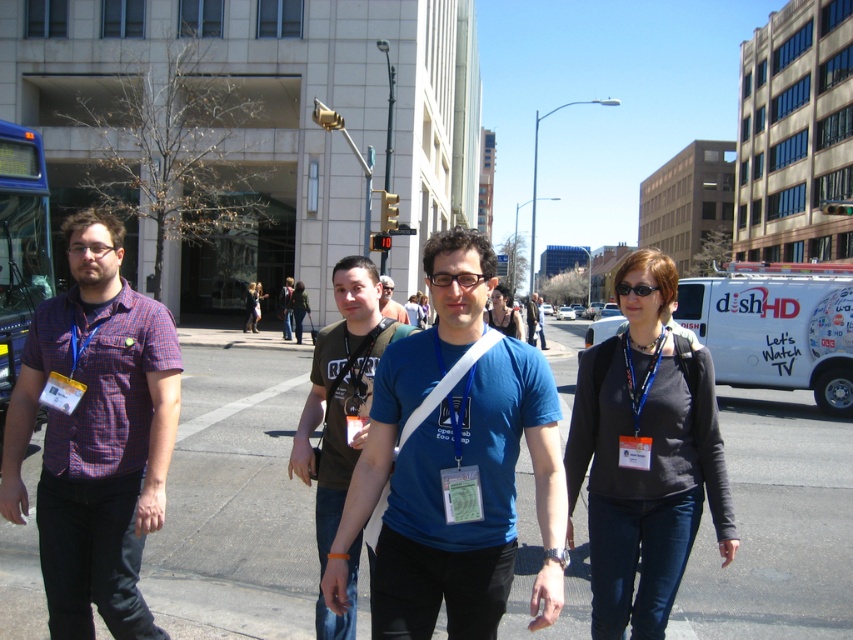
Which is behind, point (6, 136) or point (541, 348)?

Positioned behind is point (541, 348).

Does blue glass bus at left appear on the left side of blue fabric shirt at center?

Yes, blue glass bus at left is to the left of blue fabric shirt at center.

Who is more forward, (49, 237) or (538, 321)?

Point (49, 237) is in front.

At what (x,y) coordinates should I click in order to perform the action: click on blue glass bus at left. Please return your answer as a coordinate pair (x, y). Image resolution: width=853 pixels, height=640 pixels. Looking at the image, I should click on (20, 248).

Is dark gray sweater at center bigger than matte brown shirt at center?

Actually, dark gray sweater at center might be smaller than matte brown shirt at center.

Does dark gray sweater at center appear on the left side of matte brown shirt at center?

Incorrect, dark gray sweater at center is not on the left side of matte brown shirt at center.

In the scene shown: Who is more forward, (656,604) or (401,307)?

Point (656,604)

The width and height of the screenshot is (853, 640). Find the location of `dark gray sweater at center`. dark gray sweater at center is located at coordinates (643, 456).

Which is in front, point (229, 417) or point (349, 300)?

Point (349, 300) is more forward.

How much distance is there between gray asphalt pavement at center and matte brown t-shirt at center?

9.72 meters

Is point (515, 609) farther from camera compared to point (372, 273)?

Yes, it is.

The width and height of the screenshot is (853, 640). Find the location of `gray asphalt pavement at center`. gray asphalt pavement at center is located at coordinates (235, 506).